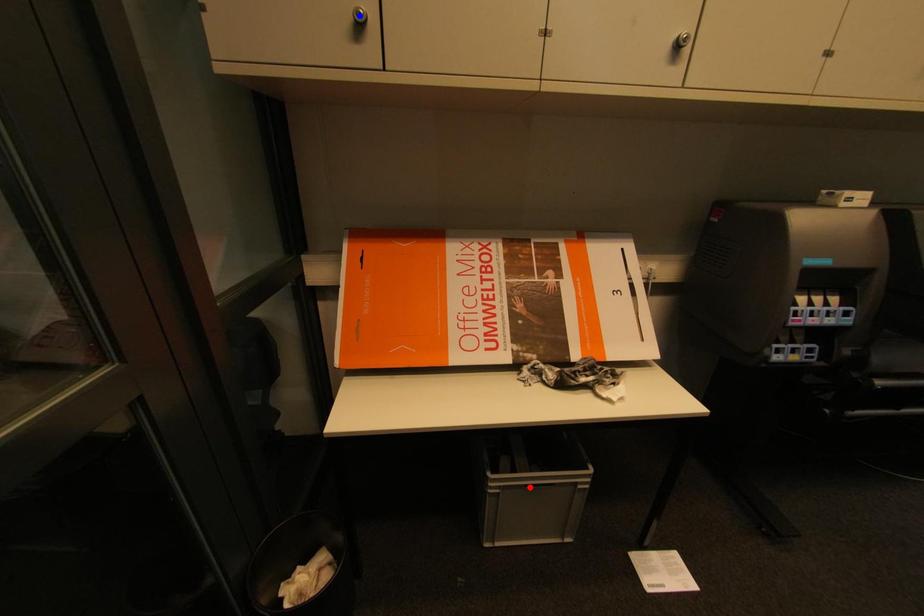
Question: Which of the two points in the image is closer to the camera?

Choices:
 (A) Blue point is closer.
 (B) Red point is closer.

Answer: (A)